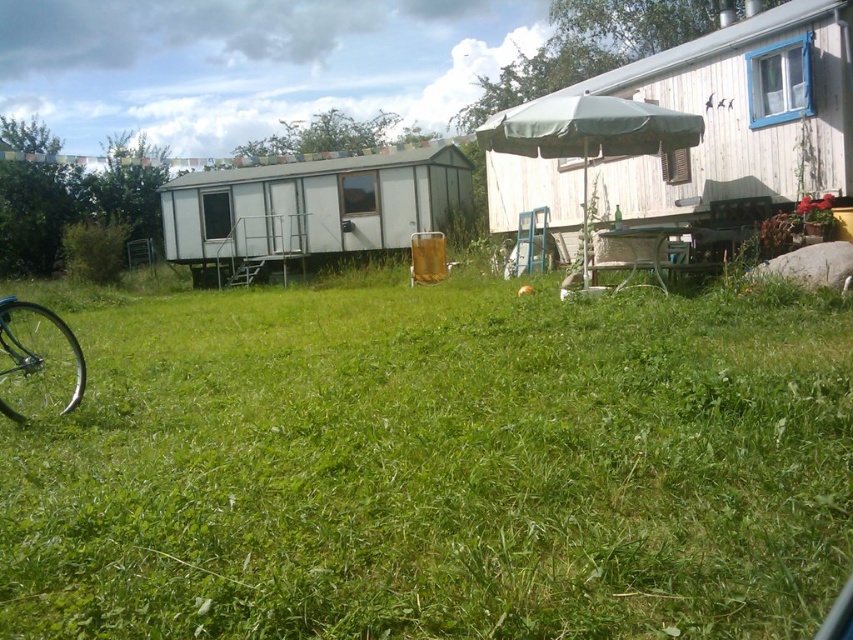
Between green fabric umbrella at center-right and shiny silver bicycle wheel at lower left, which one has more height?

shiny silver bicycle wheel at lower left

Based on the photo, does green fabric umbrella at center-right have a greater width compared to shiny silver bicycle wheel at lower left?

Indeed, green fabric umbrella at center-right has a greater width compared to shiny silver bicycle wheel at lower left.

Which is in front, point (585, 214) or point (16, 312)?

Point (16, 312) is in front.

Where is `green fabric umbrella at center-right`? green fabric umbrella at center-right is located at coordinates (589, 132).

In the scene shown: Is green grassy at center positioned before white matte trailer at center?

Yes, it is in front of white matte trailer at center.

Who is shorter, green grassy at center or white matte trailer at center?

Standing shorter between the two is green grassy at center.

Where is `green grassy at center`? The width and height of the screenshot is (853, 640). green grassy at center is located at coordinates (439, 467).

Identify the location of green grassy at center. (439, 467).

Can you confirm if white matte trailer at center is bigger than shiny silver bicycle wheel at lower left?

Actually, white matte trailer at center might be smaller than shiny silver bicycle wheel at lower left.

Is point (378, 189) closer to camera compared to point (32, 385)?

No, (378, 189) is behind (32, 385).

This screenshot has width=853, height=640. What do you see at coordinates (311, 208) in the screenshot?
I see `white matte trailer at center` at bounding box center [311, 208].

Image resolution: width=853 pixels, height=640 pixels. Identify the location of white matte trailer at center. 311,208.